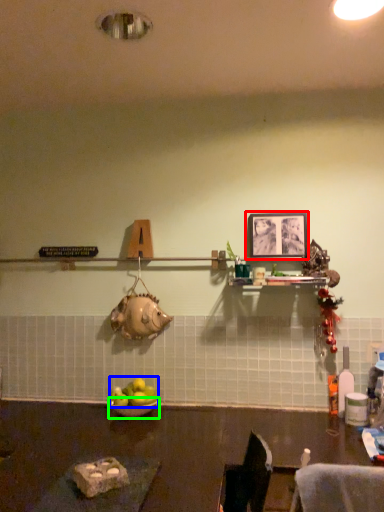
Question: Estimate the real-world distances between objects in this image. Which object is closer to picture frame (highlighted by a red box), apple (highlighted by a blue box) or bowl (highlighted by a green box)?

Choices:
 (A) apple
 (B) bowl

Answer: (A)